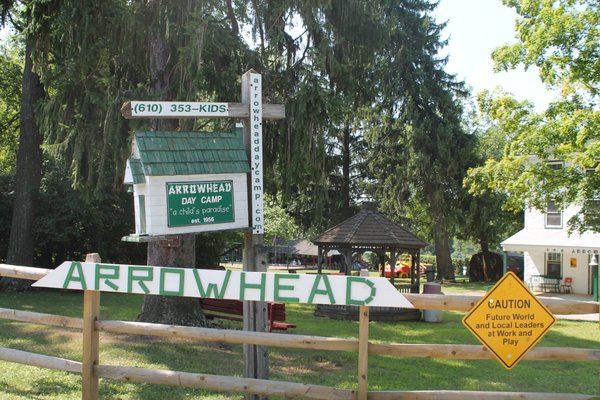
This screenshot has height=400, width=600. What are the coordinates of `wood sign that says arrowhead` in the screenshot? It's located at (191, 275).